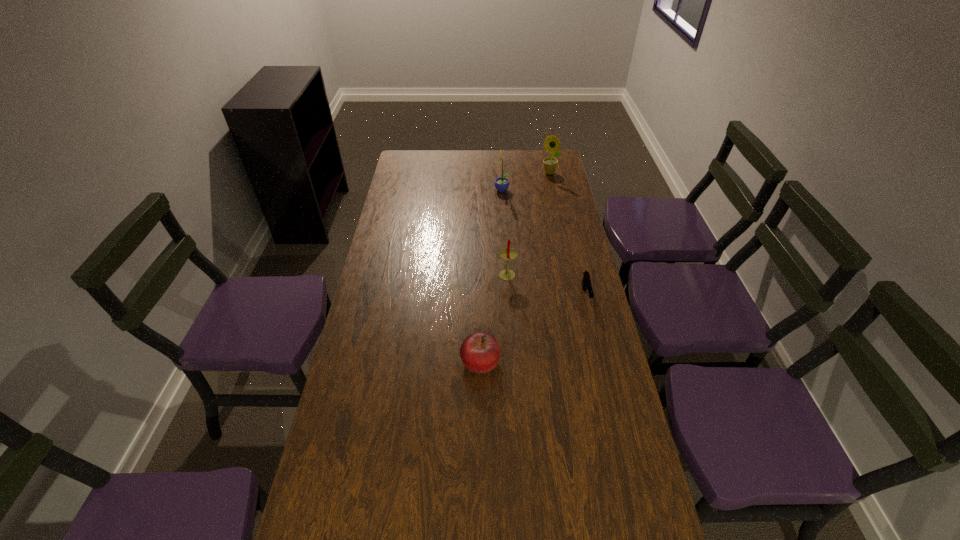
The width and height of the screenshot is (960, 540). What are the coordinates of `the farther sunflower` in the screenshot? It's located at (552, 144).

In order to click on the right sunflower in this screenshot , I will do `click(552, 144)`.

Where is `the fourth nearest object`? the fourth nearest object is located at coordinates (501, 183).

Where is `the nearer sunflower`? the nearer sunflower is located at coordinates (501, 183).

Where is `candle`? This screenshot has height=540, width=960. candle is located at coordinates (509, 254).

Identify the location of the leftmost object. This screenshot has height=540, width=960. (480, 352).

Image resolution: width=960 pixels, height=540 pixels. In order to click on the nearest object in this screenshot , I will do `click(480, 352)`.

Image resolution: width=960 pixels, height=540 pixels. In order to click on pistol in this screenshot , I will do `click(586, 281)`.

Identify the location of vacant space located on the face of the farther sunflower. pos(554,195).

Where is `vacant space located on the front-facing side of the nearer sunflower`? The width and height of the screenshot is (960, 540). vacant space located on the front-facing side of the nearer sunflower is located at coordinates (429, 191).